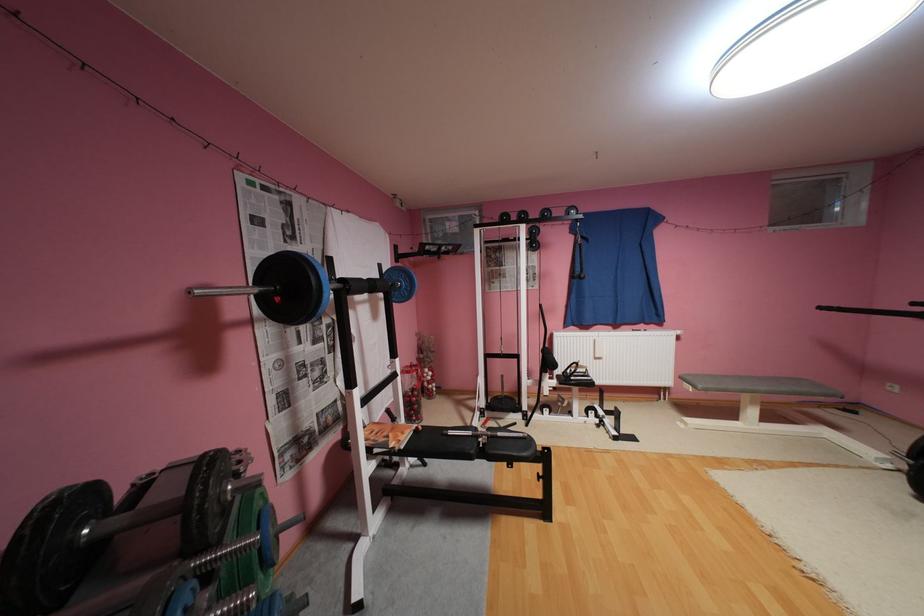
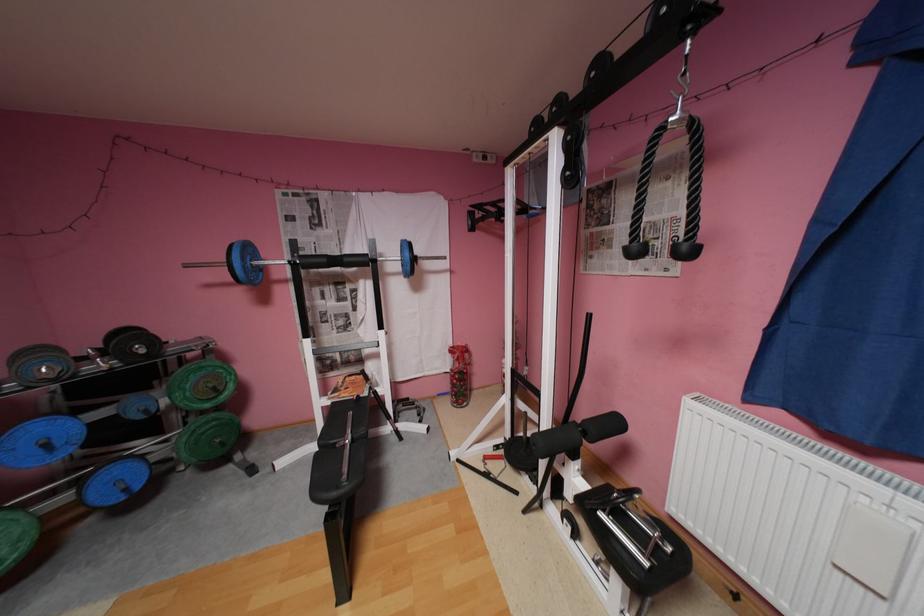
Find the pixel in the second image that matches point 380,477 in the first image.

(333, 408)